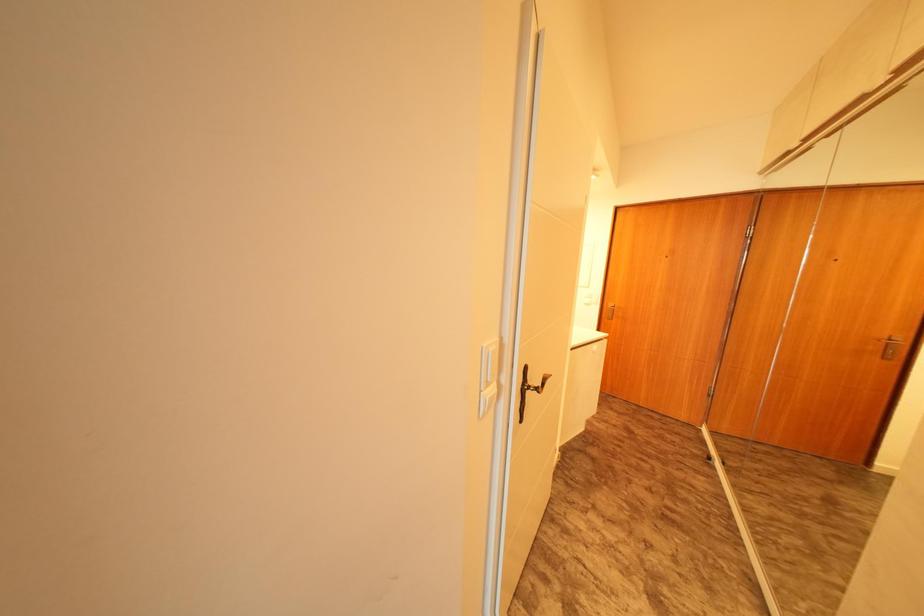
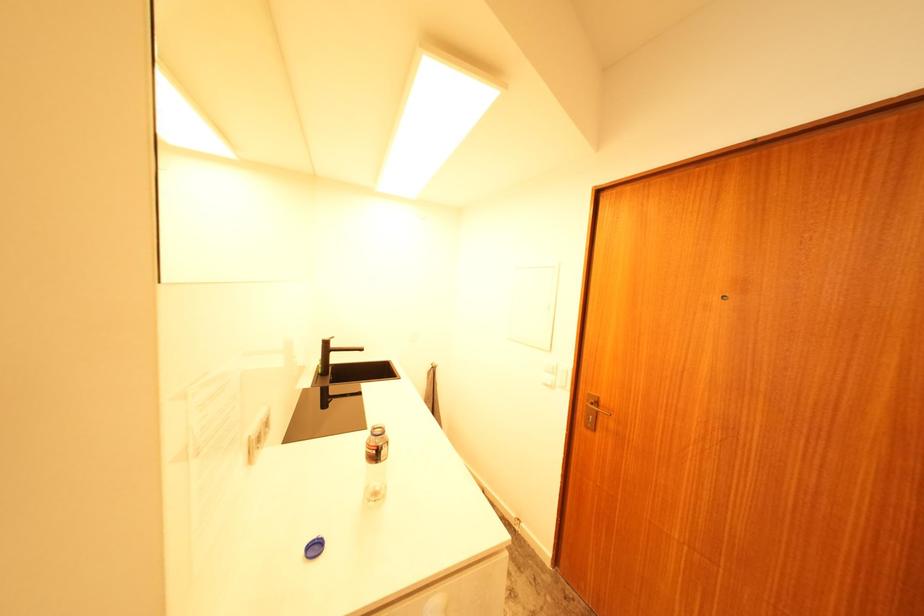
What movement of the cameraman would produce the second image?

The cameraman walked toward right, forward.